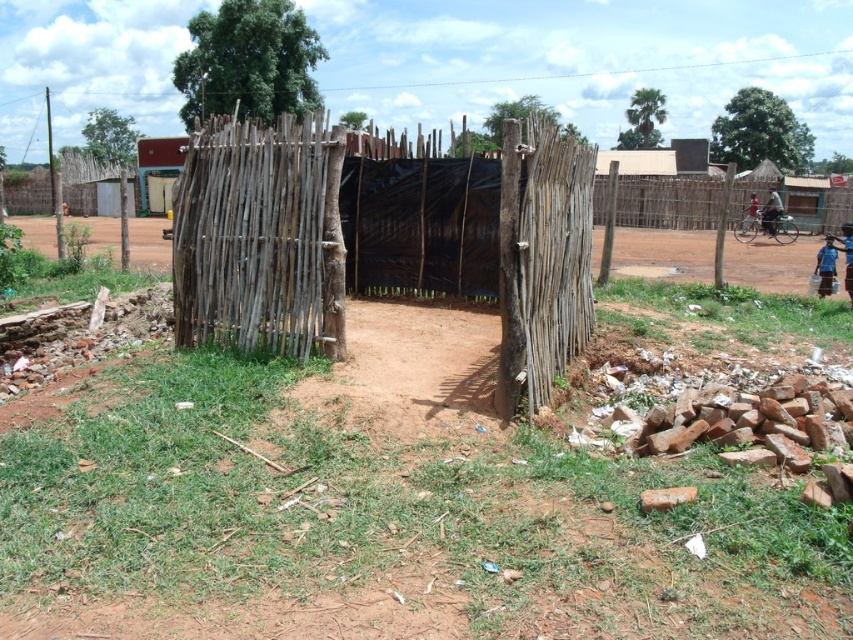
Does natural wood fence at center appear over blue fabric child at lower right?

Correct, natural wood fence at center is located above blue fabric child at lower right.

Locate an element on the screen. natural wood fence at center is located at coordinates (383, 240).

The image size is (853, 640). Identify the location of natural wood fence at center. (383, 240).